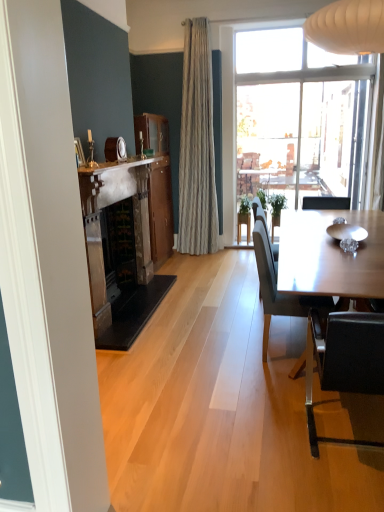
Question: From a real-world perspective, relative to dark gray fabric chair at right, positioned as the 1th chair in back-to-front order, is green matte plant at center vertically above or below?

Choices:
 (A) below
 (B) above

Answer: (A)

Question: In the image, is green matte plant at center on the left side or the right side of dark gray fabric chair at right, positioned as the 1th chair in back-to-front order?

Choices:
 (A) right
 (B) left

Answer: (A)

Question: Considering the real-world distances, which object is closest to the white marble fireplace at upper center?

Choices:
 (A) mahogany wood cabinet at center
 (B) black leather chair at lower right, acting as the 1th chair starting from the front
 (C) dark gray fabric chair at right, marked as the 2th chair in a front-to-back arrangement
 (D) wooden picture frame at upper left
 (E) green matte plant at center

Answer: (A)

Question: Estimate the real-world distances between objects in this image. Which object is farther from the green matte plant at center?

Choices:
 (A) wooden picture frame at upper left
 (B) black leather chair at lower right, acting as the 1th chair starting from the front
 (C) white marble fireplace at upper center
 (D) dark gray fabric chair at right, positioned as the 1th chair in back-to-front order
 (E) mahogany wood cabinet at center

Answer: (A)